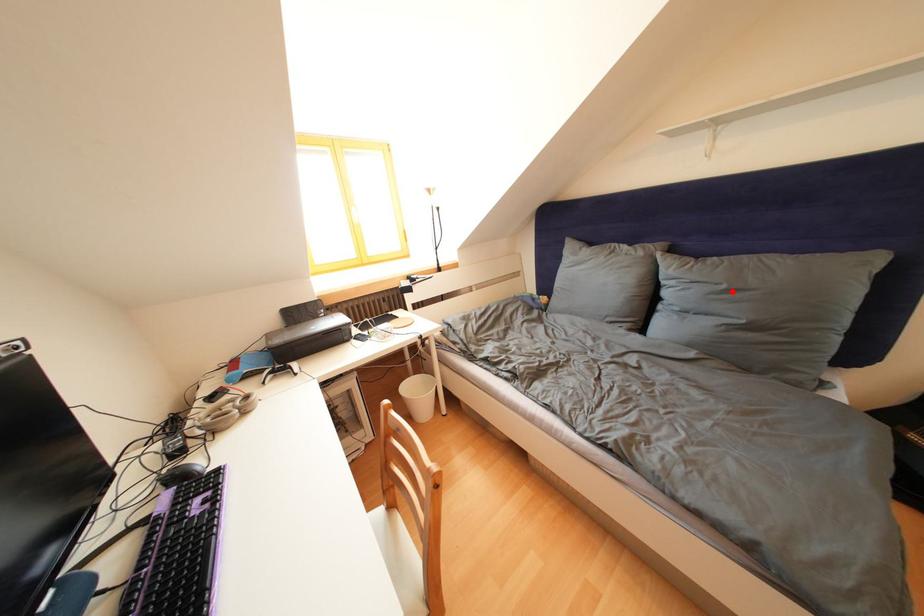
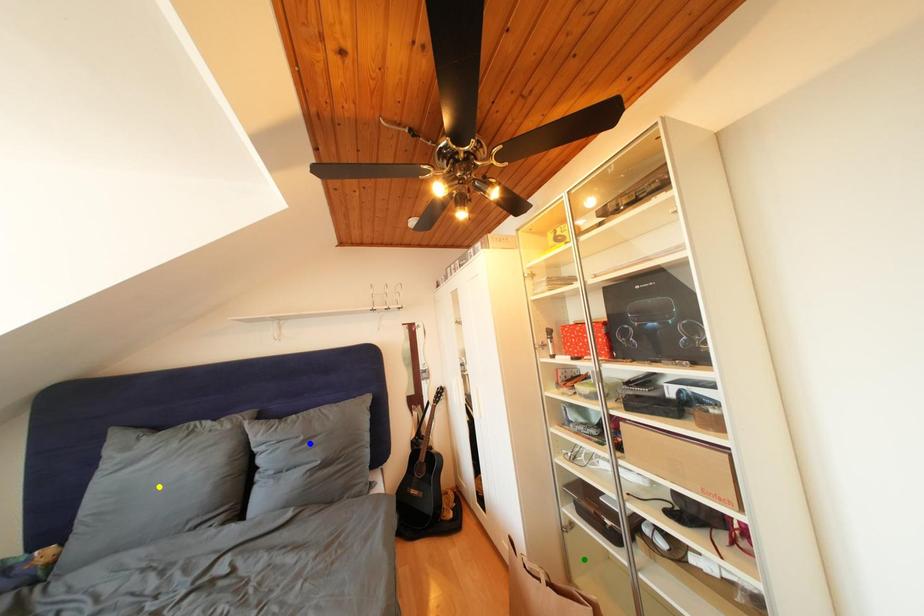
Question: I am providing you with two images of the same scene from different viewpoints. A red point is marked on the first image. You are given multiple points on the second image. Which spot in image 2 lines up with the point in image 1?

Choices:
 (A) green point
 (B) blue point
 (C) yellow point

Answer: (B)